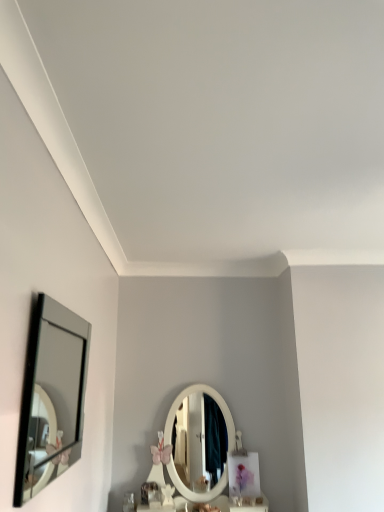
The width and height of the screenshot is (384, 512). Describe the element at coordinates (55, 405) in the screenshot. I see `matte black mirror at left` at that location.

You are a GUI agent. You are given a task and a screenshot of the screen. Output one action in this format:
    pyautogui.click(x=<x>, y=<y>)
    Task: Click on the matte black mirror at left
    The image size is (384, 512).
    Given the screenshot: What is the action you would take?
    pyautogui.click(x=55, y=405)

I want to click on matte black mirror at left, so click(55, 405).